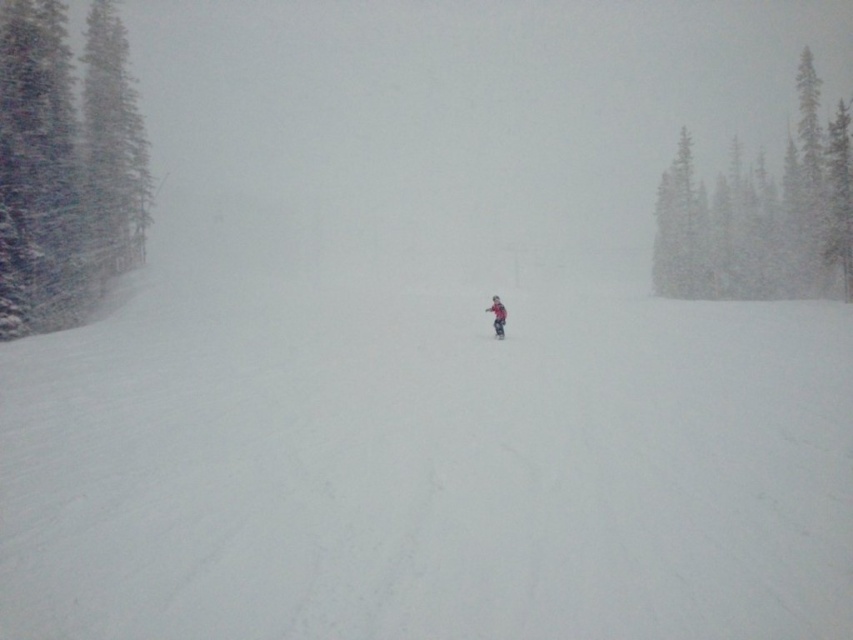
Based on the photo, you are a skier on a snowy slope during a snowstorm. You notice two objects labeled as red matte ski at center and matte red ski at center. Which one is positioned lower in the scene?

The red matte ski at center is positioned lower than the matte red ski at center in the scene.

You are a skier preparing to descend the slope. You see the green textured pine trees at left and the red matte ski at center. Which object is positioned higher in the image?

The green textured pine trees at left are positioned higher than the red matte ski at center in the image.